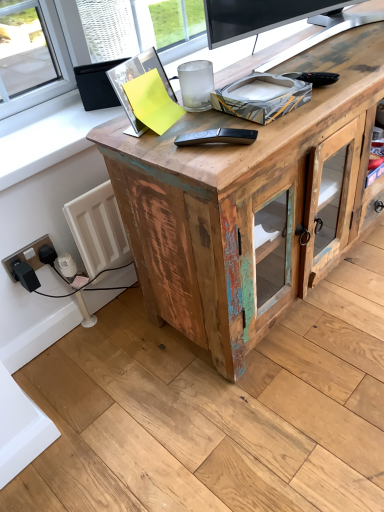
At what (x,y) coordinates should I click in order to perform the action: click on vacant area that lies to the right of black plastic remote control at center. Please return your answer as a coordinate pair (x, y). Looking at the image, I should click on (276, 124).